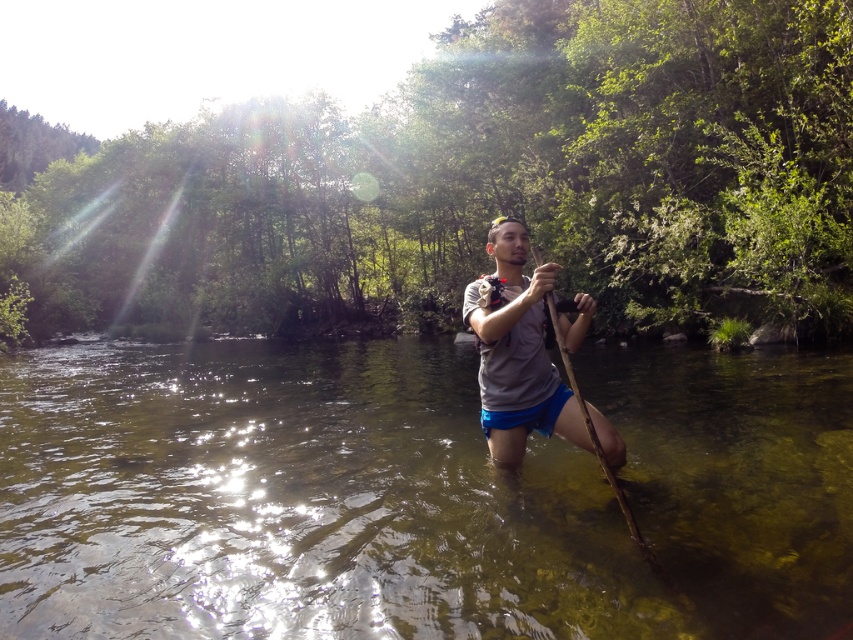
Which is more to the left, clear water at center or brown wooden paddle at center?

clear water at center is more to the left.

Is clear water at center above brown wooden paddle at center?

Incorrect, clear water at center is not positioned above brown wooden paddle at center.

Between point (143, 518) and point (596, 452), which one is positioned behind?

The point (143, 518) is behind.

Image resolution: width=853 pixels, height=640 pixels. I want to click on clear water at center, so click(415, 496).

Between clear water at center and gray matte shirt at center, which one appears on the left side from the viewer's perspective?

Positioned to the left is clear water at center.

Does point (624, 396) come behind point (537, 355)?

Yes, point (624, 396) is behind point (537, 355).

Where is `clear water at center`? The image size is (853, 640). clear water at center is located at coordinates (415, 496).

Who is positioned more to the left, gray matte shirt at center or brown wooden paddle at center?

Positioned to the left is gray matte shirt at center.

Measure the distance from gray matte shirt at center to brown wooden paddle at center.

gray matte shirt at center and brown wooden paddle at center are 10.10 inches apart.

Which is in front, point (569, 435) or point (672, 588)?

Point (672, 588) is more forward.

At what (x,y) coordinates should I click in order to perform the action: click on gray matte shirt at center. Please return your answer as a coordinate pair (x, y). The image size is (853, 640). Looking at the image, I should click on (517, 349).